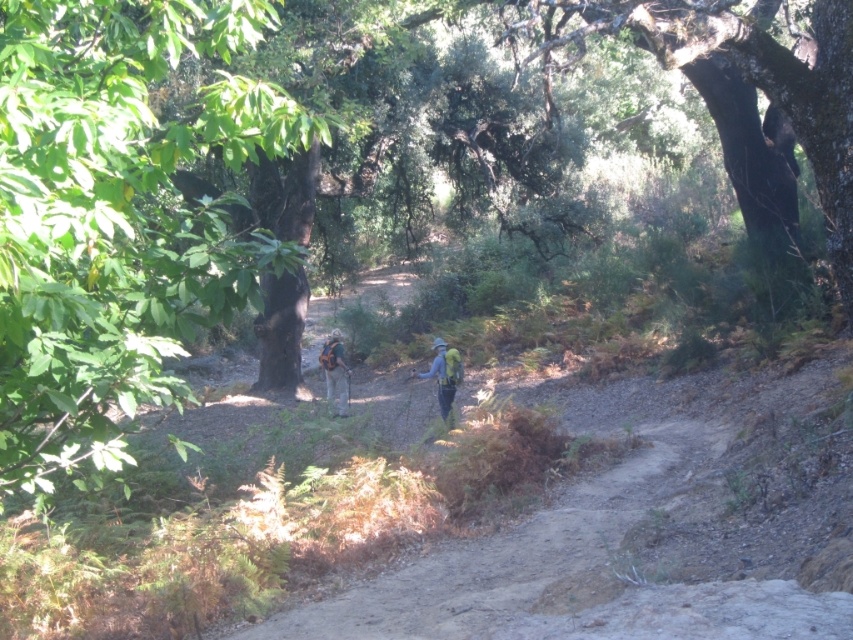
Does camouflage fabric backpack at center appear on the left side of blue fabric backpack at center?

Indeed, camouflage fabric backpack at center is positioned on the left side of blue fabric backpack at center.

Between camouflage fabric backpack at center and blue fabric backpack at center, which one has less height?

With less height is camouflage fabric backpack at center.

Which is behind, point (456, 358) or point (453, 380)?

The point (456, 358) is more distant.

Locate an element on the screen. The image size is (853, 640). camouflage fabric backpack at center is located at coordinates (442, 372).

Who is higher up, dirt path at center or camouflage backpack at center?

camouflage backpack at center

The width and height of the screenshot is (853, 640). Identify the location of dirt path at center. (524, 564).

Image resolution: width=853 pixels, height=640 pixels. Find the location of `dirt path at center`. dirt path at center is located at coordinates (524, 564).

Is camouflage fabric backpack at center bigger than camouflage backpack at center?

Incorrect, camouflage fabric backpack at center is not larger than camouflage backpack at center.

Between camouflage fabric backpack at center and camouflage backpack at center, which one appears on the left side from the viewer's perspective?

Positioned to the left is camouflage fabric backpack at center.

Is point (331, 349) farther from viewer compared to point (332, 337)?

No, it is in front of (332, 337).

Where is `camouflage fabric backpack at center`? camouflage fabric backpack at center is located at coordinates pyautogui.click(x=442, y=372).